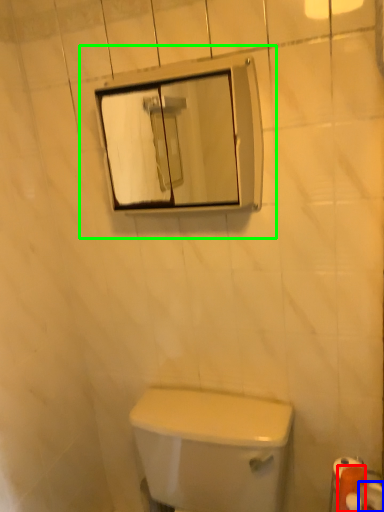
Question: Based on their relative distances, which object is farther from toilet paper (highlighted by a red box)? Choose from toilet paper (highlighted by a blue box) and view mirror (highlighted by a green box).

Choices:
 (A) toilet paper
 (B) view mirror

Answer: (B)